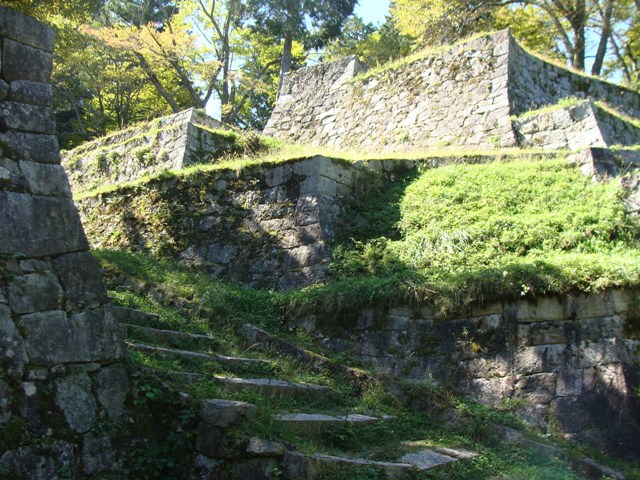
Where is `lowest wall`? This screenshot has width=640, height=480. lowest wall is located at coordinates (536, 321).